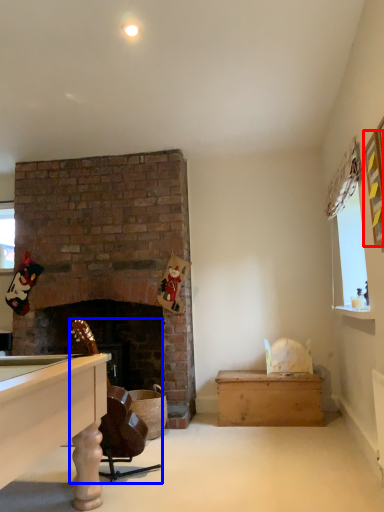
Question: Among these objects, which one is nearest to the camera, picture frame (highlighted by a red box) or rocking chair (highlighted by a blue box)?

Choices:
 (A) picture frame
 (B) rocking chair

Answer: (A)